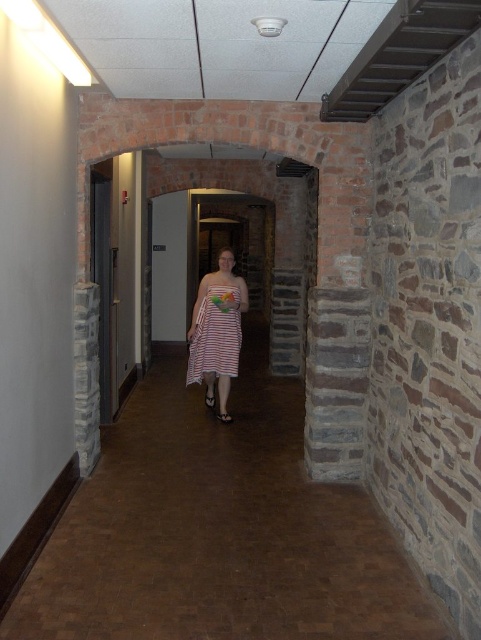
Question: Is brown polished wood floor at center positioned behind striped fabric dress at center?

Choices:
 (A) yes
 (B) no

Answer: (B)

Question: Is brown polished wood floor at center to the left of striped fabric dress at center from the viewer's perspective?

Choices:
 (A) yes
 (B) no

Answer: (B)

Question: Which of these objects is positioned closest to the striped cotton dress at center?

Choices:
 (A) translucent plastic bouquet at center
 (B) striped fabric dress at center
 (C) brown polished wood floor at center

Answer: (B)

Question: Is brown polished wood floor at center wider than translucent plastic bouquet at center?

Choices:
 (A) yes
 (B) no

Answer: (A)

Question: Considering the real-world distances, which object is closest to the brown polished wood floor at center?

Choices:
 (A) translucent plastic bouquet at center
 (B) striped cotton dress at center

Answer: (B)

Question: Which is farther from the striped cotton dress at center?

Choices:
 (A) brown polished wood floor at center
 (B) striped fabric dress at center
 (C) translucent plastic bouquet at center

Answer: (A)